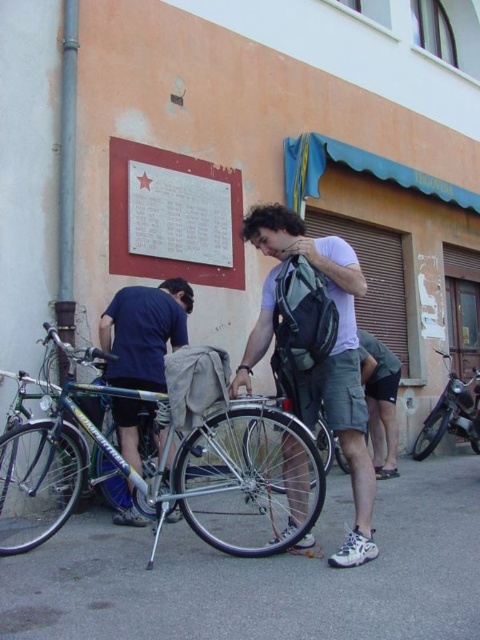
You are standing at the point with coordinates [154,472] in the image. What object are you directly facing?

The point at [154,472] directly faces the green metallic bicycle at center.

You are a delivery person who needs to load a package onto the shiny metallic bicycle at center. The package is taller than the matte gray backpack at center. Will the package fit on the bicycle without exceeding its height limit?

The matte gray backpack at center is much taller than the shiny metallic bicycle at center. Since the package is taller than the matte gray backpack at center, it will be even taller than the bicycle itself. Therefore, the package will not fit on the shiny metallic bicycle at center without exceeding its height limit.